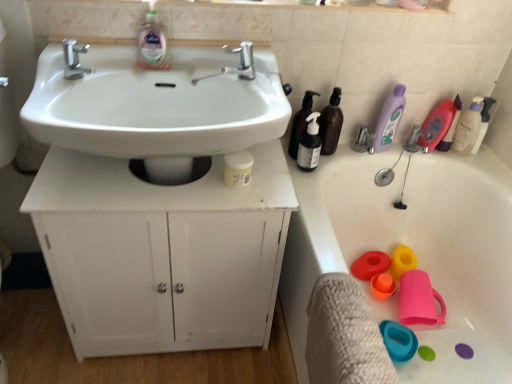
Question: Does white matte cabinet at center turn towards matte plastic bath at right?

Choices:
 (A) no
 (B) yes

Answer: (A)

Question: From a real-world perspective, is white matte cabinet at center on matte plastic bath at right?

Choices:
 (A) yes
 (B) no

Answer: (A)

Question: From the image's perspective, is white matte cabinet at center above matte plastic bath at right?

Choices:
 (A) no
 (B) yes

Answer: (B)

Question: Is white matte cabinet at center thinner than matte plastic bath at right?

Choices:
 (A) yes
 (B) no

Answer: (A)

Question: Is white matte cabinet at center facing away from matte plastic bath at right?

Choices:
 (A) no
 (B) yes

Answer: (A)

Question: Considering the relative sizes of white matte cabinet at center and matte plastic bath at right in the image provided, is white matte cabinet at center shorter than matte plastic bath at right?

Choices:
 (A) yes
 (B) no

Answer: (B)

Question: From a real-world perspective, is polished chrome faucet at upper left, which is the second tap in right-to-left order, under purple translucent bottle at upper right, which is the 2th cleaning product in left-to-right order?

Choices:
 (A) yes
 (B) no

Answer: (B)

Question: Does polished chrome faucet at upper left, which is the second tap in right-to-left order, have a larger size compared to purple translucent bottle at upper right, arranged as the fourth cleaning product when viewed from the right?

Choices:
 (A) no
 (B) yes

Answer: (A)

Question: Considering the relative sizes of polished chrome faucet at upper left, the 1th tap from the left, and purple translucent bottle at upper right, which is the 2th cleaning product in left-to-right order, in the image provided, is polished chrome faucet at upper left, the 1th tap from the left, smaller than purple translucent bottle at upper right, which is the 2th cleaning product in left-to-right order,?

Choices:
 (A) yes
 (B) no

Answer: (A)

Question: Can you confirm if polished chrome faucet at upper left, the 1th tap from the left, is wider than purple translucent bottle at upper right, which is the 2th cleaning product in left-to-right order?

Choices:
 (A) yes
 (B) no

Answer: (A)

Question: Is polished chrome faucet at upper left, which is the second tap in right-to-left order, taller than purple translucent bottle at upper right, arranged as the fourth cleaning product when viewed from the right?

Choices:
 (A) yes
 (B) no

Answer: (B)

Question: Can we say polished chrome faucet at upper left, the 1th tap from the left, lies outside purple translucent bottle at upper right, which is the 2th cleaning product in left-to-right order?

Choices:
 (A) yes
 (B) no

Answer: (A)

Question: Can you see white matte cabinet at center touching white matte jar at center, arranged as the first toiletry when viewed from the front?

Choices:
 (A) yes
 (B) no

Answer: (B)